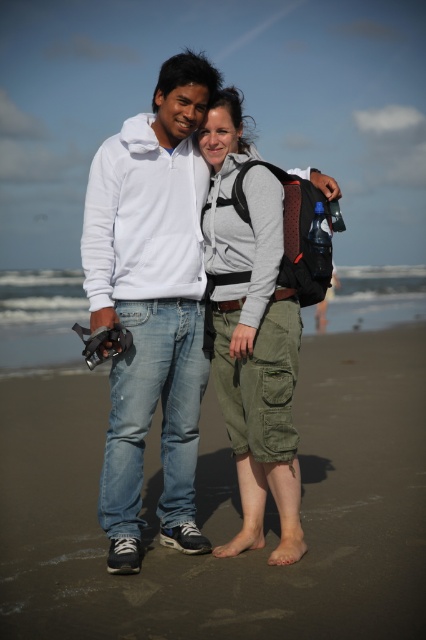
Question: Which object is the closest to the white cotton hoodie at center?

Choices:
 (A) brown sandy beach at lower center
 (B) olive green cargo shorts at center

Answer: (B)

Question: Is brown sandy beach at lower center wider than olive green cargo shorts at center?

Choices:
 (A) no
 (B) yes

Answer: (B)

Question: Which of the following is the farthest from the observer?

Choices:
 (A) olive green cargo shorts at center
 (B) brown sandy beach at lower center
 (C) white cotton hoodie at center

Answer: (A)

Question: Which object is farther from the camera taking this photo?

Choices:
 (A) brown sandy beach at lower center
 (B) white cotton hoodie at center
 (C) olive green cargo shorts at center

Answer: (C)

Question: Is brown sandy beach at lower center below olive green cargo shorts at center?

Choices:
 (A) no
 (B) yes

Answer: (B)

Question: Does brown sandy beach at lower center appear on the right side of white cotton hoodie at center?

Choices:
 (A) no
 (B) yes

Answer: (B)